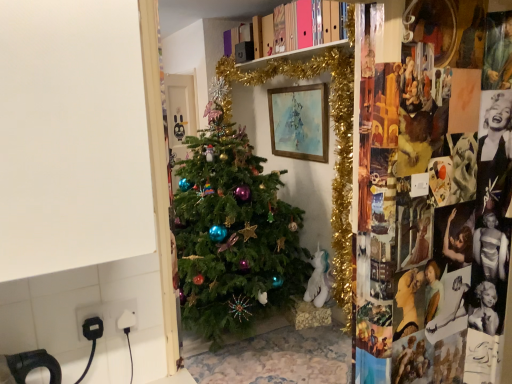
Where is `vacant region above watercolor paper painting at center (from a real-world perspective)`? The width and height of the screenshot is (512, 384). vacant region above watercolor paper painting at center (from a real-world perspective) is located at coordinates (286, 84).